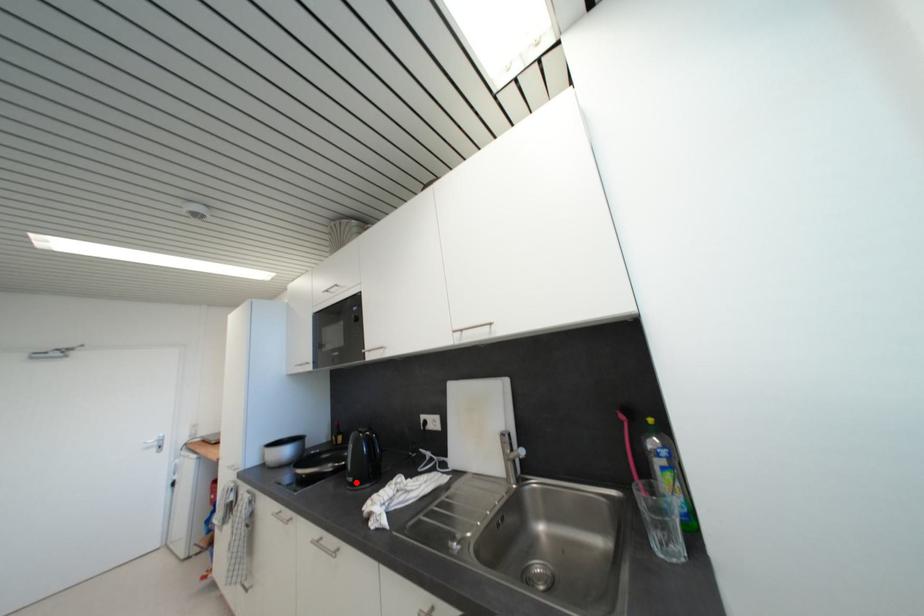
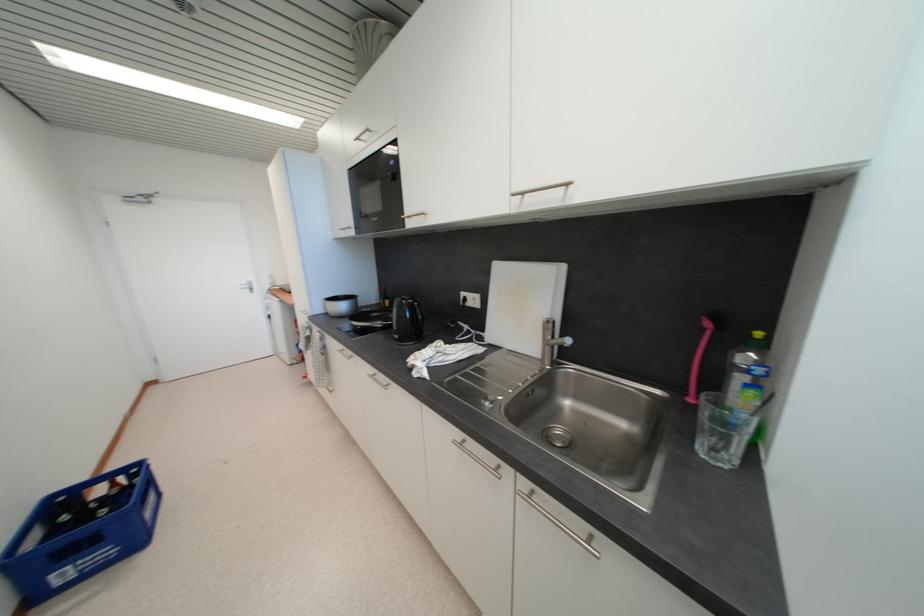
In the second image, find the point that corresponds to the highlighted location in the first image.

(402, 339)